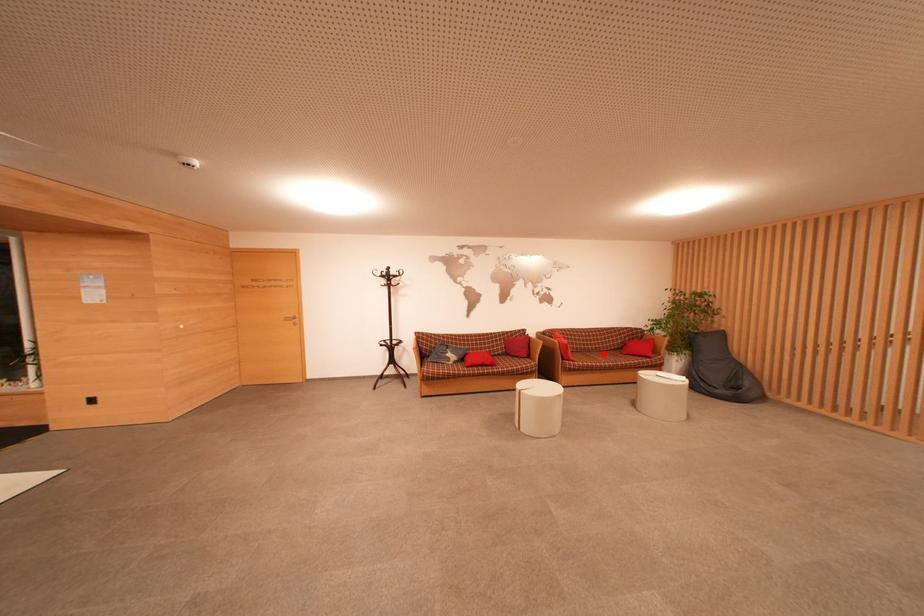
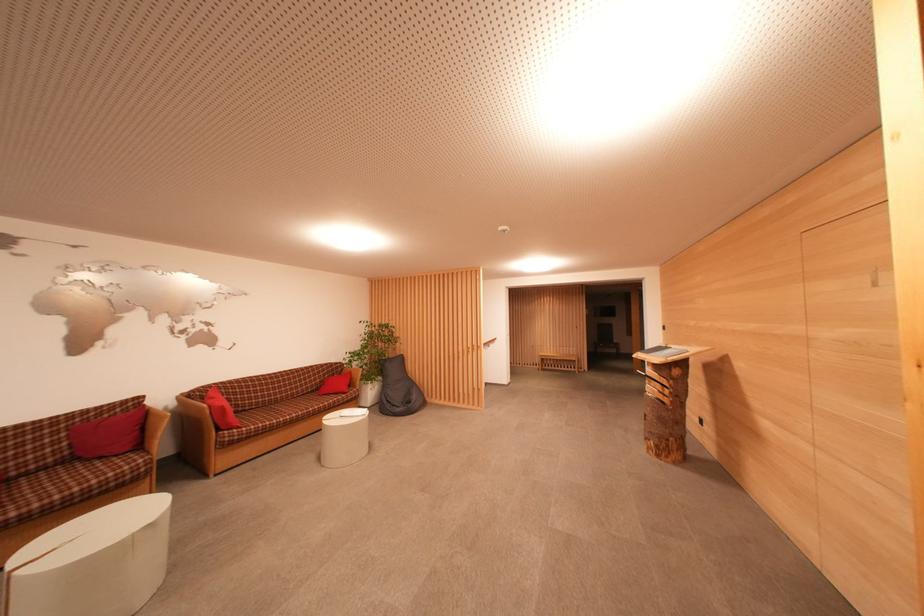
Find the pixel in the second image that matches the highlighted location in the first image.

(296, 400)